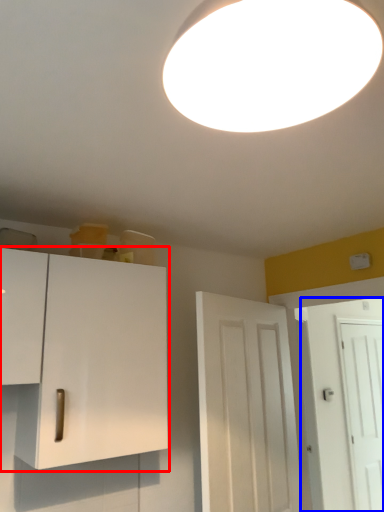
Question: Among these objects, which one is farthest to the camera, cabinetry (highlighted by a red box) or door (highlighted by a blue box)?

Choices:
 (A) cabinetry
 (B) door

Answer: (B)